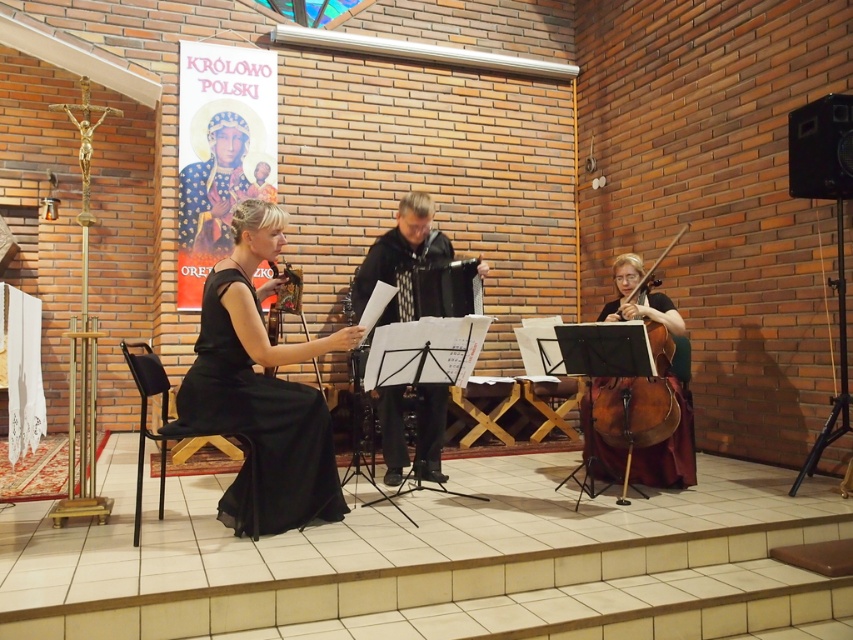
You are a photographer setting up for a concert photo shoot. You have two items to focus on in the image provided. The black satin dress at center and the black textured accordion at center. Which of these two items is larger in size?

The black satin dress at center is bigger than the black textured accordion at center, so the black satin dress at center is larger in size.

You are a photographer setting up for a concert photo shoot in the described church scene. You need to position your camera so that both the black satin dress at center and the black textured accordion at center are in frame. Based on their positions, which object should appear higher in the photo?

The black satin dress at center is below the black textured accordion at center, so the black textured accordion at center will appear higher in the photo.

You are a photographer setting up for a group photo of the musicians. You want to position your camera so that the black satin dress at center and the brown wooden cello at right are both in frame. Based on their positions, which object should be placed closer to the left side of the camera frame?

The black satin dress at center is to the left of the brown wooden cello at right, so the black satin dress at center should be positioned closer to the left side of the camera frame.